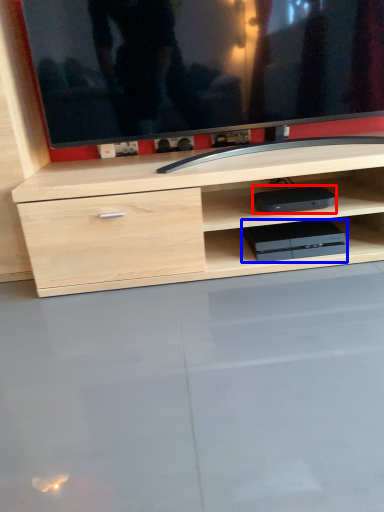
Question: Which of the following is the closest to the observer, equipment (highlighted by a red box) or equipment (highlighted by a blue box)?

Choices:
 (A) equipment
 (B) equipment

Answer: (A)